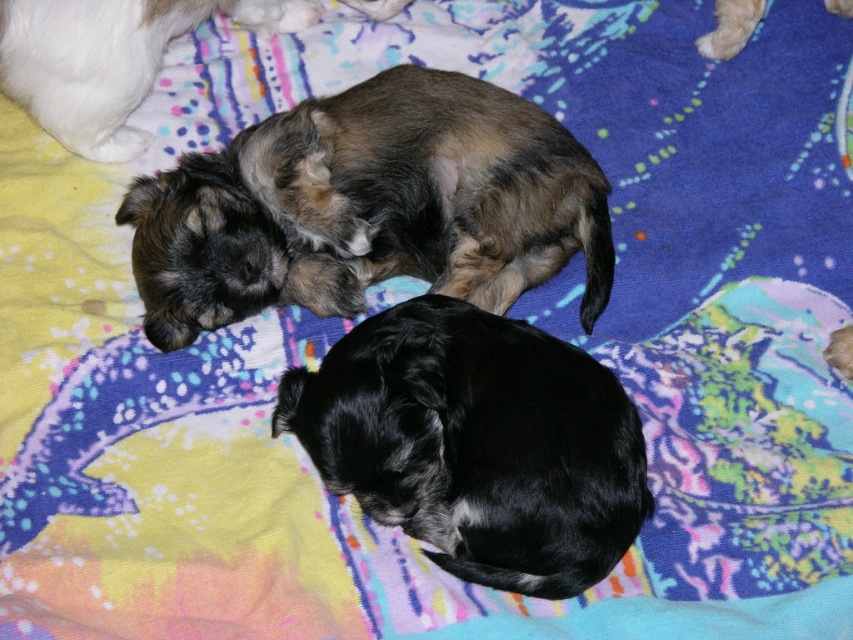
Does black fur dog at center have a greater height compared to light brown fur at upper right?

Yes, black fur dog at center is taller than light brown fur at upper right.

Who is higher up, black fur dog at center or light brown fur at upper right?

Positioned higher is light brown fur at upper right.

Between point (387, 376) and point (764, 10), which one is positioned in front?

Point (387, 376)

Where is `black fur dog at center`? The image size is (853, 640). black fur dog at center is located at coordinates (477, 444).

Does brown fuzzy dog at center have a greater height compared to light brown fur at upper right?

Correct, brown fuzzy dog at center is much taller as light brown fur at upper right.

Does brown fuzzy dog at center appear on the right side of light brown fur at upper right?

In fact, brown fuzzy dog at center is to the left of light brown fur at upper right.

The height and width of the screenshot is (640, 853). I want to click on brown fuzzy dog at center, so click(x=370, y=205).

How distant is brown fuzzy puppy at upper left from light brown fur at upper right?

brown fuzzy puppy at upper left and light brown fur at upper right are 32.05 inches apart from each other.

Does point (195, 19) come farther from viewer compared to point (699, 40)?

No, it is not.

Does point (70, 76) lie behind point (830, 8)?

No, it is not.

Identify the location of brown fuzzy puppy at upper left. (109, 60).